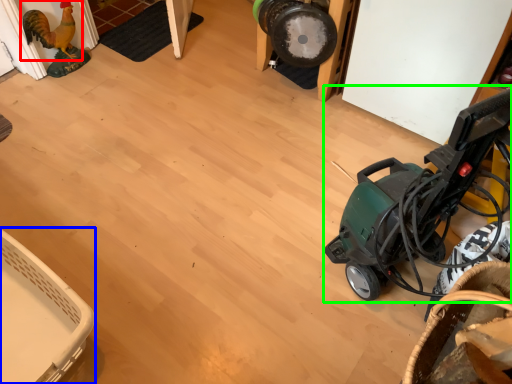
Question: Estimate the real-world distances between objects in this image. Which object is closer to chicken (highlighted by a red box), basket (highlighted by a blue box) or baby carriage (highlighted by a green box)?

Choices:
 (A) basket
 (B) baby carriage

Answer: (A)